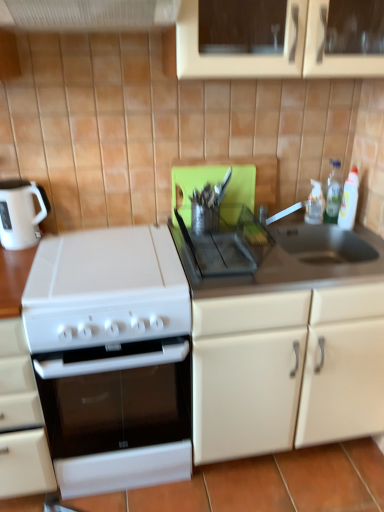
Image resolution: width=384 pixels, height=512 pixels. I want to click on vacant space in white plastic exhaust hood at upper center (from a real-world perspective), so click(x=120, y=249).